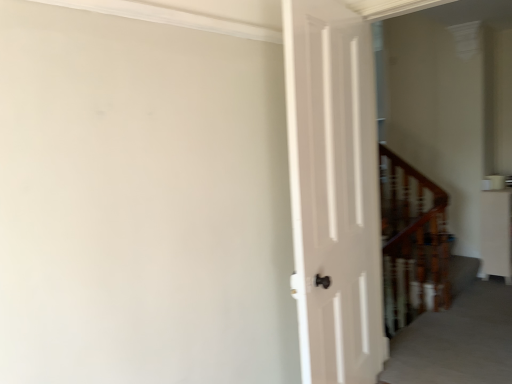
Where is `white glossy cabinet at right`? white glossy cabinet at right is located at coordinates (496, 234).

The image size is (512, 384). What do you see at coordinates (496, 234) in the screenshot? I see `white glossy cabinet at right` at bounding box center [496, 234].

Where is `wooden staircase at right`? The height and width of the screenshot is (384, 512). wooden staircase at right is located at coordinates point(412,242).

Looking at this image, measure the distance between point [443,245] and camera.

The depth of point [443,245] is 3.34 meters.

What do you see at coordinates (412, 242) in the screenshot? I see `wooden staircase at right` at bounding box center [412, 242].

The image size is (512, 384). In order to click on white glossy cabinet at right in this screenshot , I will do `click(496, 234)`.

Based on the photo, which is more to the right, wooden staircase at right or white glossy cabinet at right?

From the viewer's perspective, white glossy cabinet at right appears more on the right side.

In the image, is wooden staircase at right positioned in front of or behind white glossy cabinet at right?

In the image, wooden staircase at right appears in front of white glossy cabinet at right.

Is point (383, 204) positioned after point (502, 208)?

Yes, point (383, 204) is behind point (502, 208).

From the image's perspective, which one is positioned higher, wooden staircase at right or white glossy cabinet at right?

wooden staircase at right appears higher in the image.

From a real-world perspective, is wooden staircase at right located higher than white glossy cabinet at right?

Yes, from a real-world perspective, wooden staircase at right is above white glossy cabinet at right.

Between wooden staircase at right and white glossy cabinet at right, which one has larger width?

Wider between the two is wooden staircase at right.

Between wooden staircase at right and white glossy cabinet at right, which one has less height?

Standing shorter between the two is white glossy cabinet at right.

Which of these two, wooden staircase at right or white glossy cabinet at right, is bigger?

white glossy cabinet at right.

Is white glossy cabinet at right located within wooden staircase at right?

Definitely not — white glossy cabinet at right is not inside wooden staircase at right.

Is wooden staircase at right next to white glossy cabinet at right and touching it?

They are not placed beside each other.

Could you tell me if wooden staircase at right is facing white glossy cabinet at right?

No, wooden staircase at right is not turned towards white glossy cabinet at right.

Measure the distance between wooden staircase at right and white glossy cabinet at right.

A distance of 70.39 centimeters exists between wooden staircase at right and white glossy cabinet at right.

Locate an element on the screen. Image resolution: width=512 pixels, height=384 pixels. furniture located on the right of wooden staircase at right is located at coordinates (496, 234).

Does white glossy cabinet at right appear on the left side of wooden staircase at right?

In fact, white glossy cabinet at right is to the right of wooden staircase at right.

Considering the relative positions of white glossy cabinet at right and wooden staircase at right in the image provided, is white glossy cabinet at right in front of wooden staircase at right?

No, white glossy cabinet at right is further to the viewer.

Is point (506, 247) farther from viewer compared to point (411, 296)?

Yes.

From the image's perspective, is white glossy cabinet at right above or below wooden staircase at right?

Clearly, from the image's perspective, white glossy cabinet at right is below wooden staircase at right.

From a real-world perspective, relative to wooden staircase at right, is white glossy cabinet at right vertically above or below?

white glossy cabinet at right is below wooden staircase at right.

Between white glossy cabinet at right and wooden staircase at right, which one has larger width?

wooden staircase at right is wider.

Between white glossy cabinet at right and wooden staircase at right, which one has less height?

Standing shorter between the two is white glossy cabinet at right.

Who is bigger, white glossy cabinet at right or wooden staircase at right?

white glossy cabinet at right is bigger.

Is white glossy cabinet at right situated inside wooden staircase at right or outside?

white glossy cabinet at right lies outside wooden staircase at right.

Is white glossy cabinet at right far away from wooden staircase at right?

Actually, white glossy cabinet at right and wooden staircase at right are a little close together.

Could you tell me if white glossy cabinet at right is turned towards wooden staircase at right?

No, white glossy cabinet at right is not turned towards wooden staircase at right.

How far apart are white glossy cabinet at right and wooden staircase at right?

A distance of 27.71 inches exists between white glossy cabinet at right and wooden staircase at right.

This screenshot has width=512, height=384. In order to click on furniture below the wooden staircase at right (from the image's perspective) in this screenshot , I will do `click(496, 234)`.

Find the location of a particular element. The image size is (512, 384). furniture below the wooden staircase at right (from a real-world perspective) is located at coordinates tap(496, 234).

The image size is (512, 384). In order to click on furniture behind the wooden staircase at right in this screenshot , I will do `click(496, 234)`.